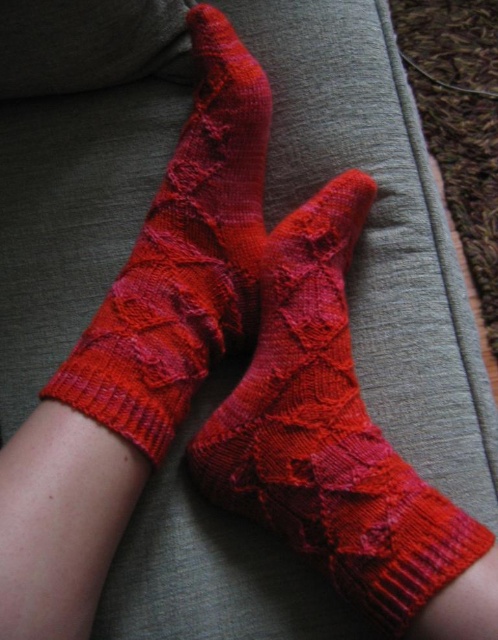
You are looking at the socks on the light gray fabric surface. There are two points marked on the socks, one at point coordinates point (338, 289) and another at point coordinates point (124, 289). Which point is closer to your eyes?

Point (338, 289) is further to the camera than point (124, 289), so the point closer to your eyes is point (124, 289).

You are organizing a sock collection and need to place the point at coordinates point (332,436) on the image. Which item from the scene is located exactly at that point?

The point (332,436) corresponds to the matte red yarn socks at center.

You are a tailor trying to place a 6.5 inch wide decorative ribbon between the two socks. Based on the scene, will the ribbon fit between the matte red yarn socks at center and the matte red knitted socks at center?

The distance between the matte red yarn socks at center and the matte red knitted socks at center is 6.06 inches. Since the ribbon is 6.5 inches wide, it will not fit between them as it is slightly wider than the available space.